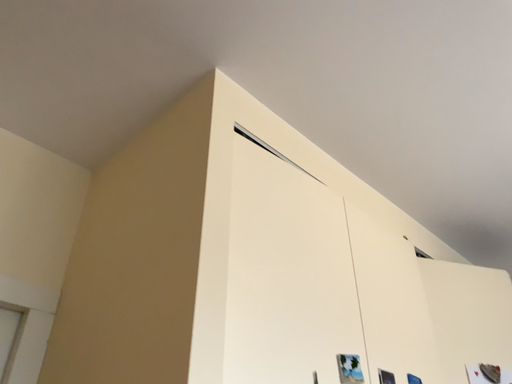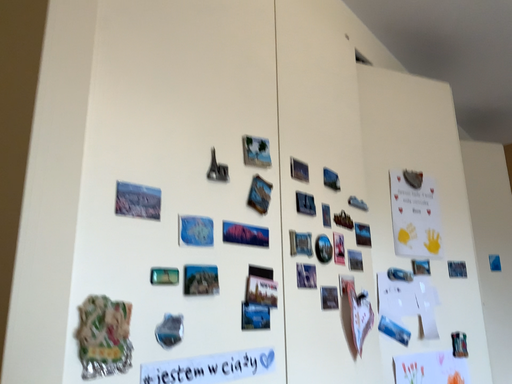
Question: How did the camera likely rotate when shooting the video?

Choices:
 (A) rotated upward
 (B) rotated downward

Answer: (B)